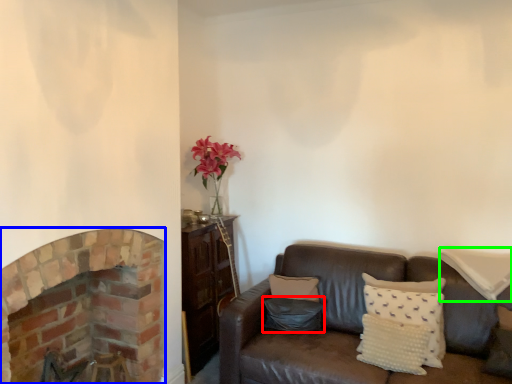
Question: Which object is the closest to the pillow (highlighted by a red box)? Choose among these: fireplace (highlighted by a blue box) or pillow (highlighted by a green box).

Choices:
 (A) fireplace
 (B) pillow

Answer: (B)